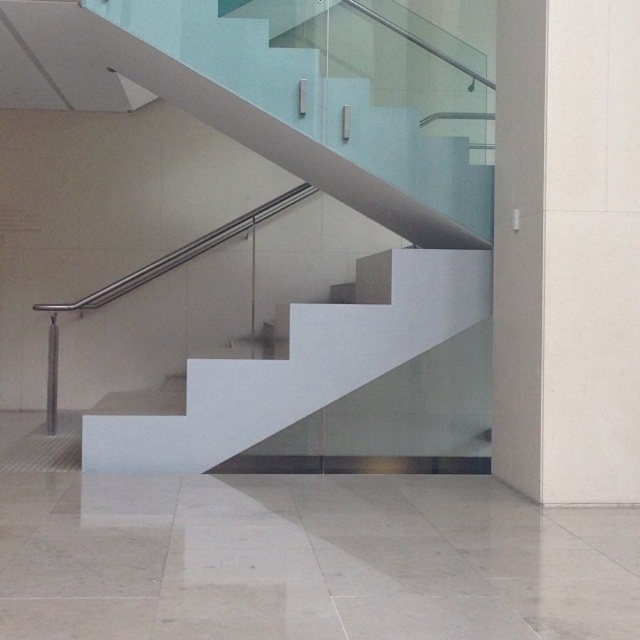
Question: Which point is closer to the camera?

Choices:
 (A) white smooth pillar at right
 (B) white glossy stairs at center

Answer: (A)

Question: In this image, where is white glossy stairs at center located relative to white smooth pillar at right?

Choices:
 (A) above
 (B) below

Answer: (A)

Question: Among these points, which one is farthest from the camera?

Choices:
 (A) (632, 444)
 (B) (404, 280)

Answer: (B)

Question: Can you confirm if white glossy stairs at center is wider than white smooth pillar at right?

Choices:
 (A) no
 (B) yes

Answer: (B)

Question: Does white glossy stairs at center have a lesser width compared to white smooth pillar at right?

Choices:
 (A) no
 (B) yes

Answer: (A)